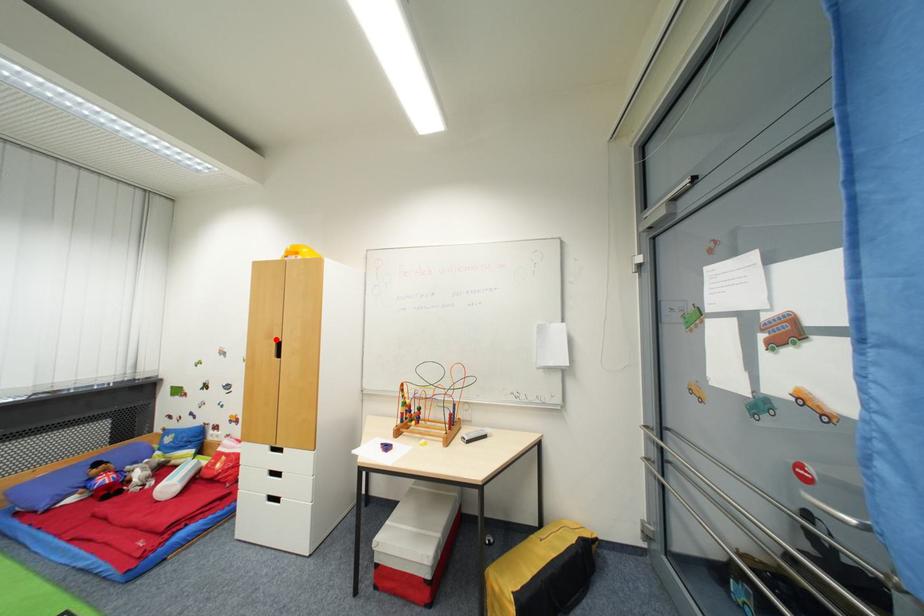
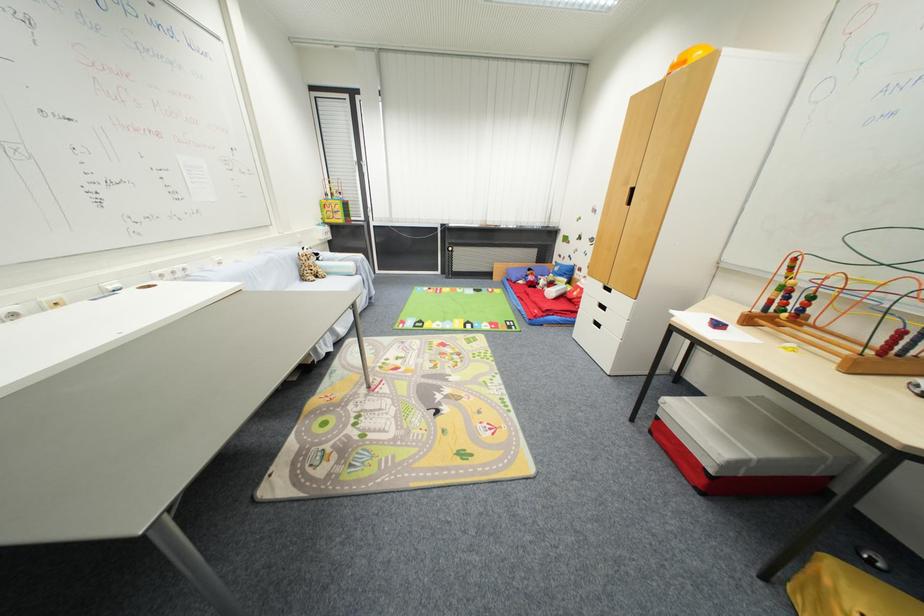
Locate, in the second image, the point that corresponds to the highlighted location in the first image.

(631, 185)